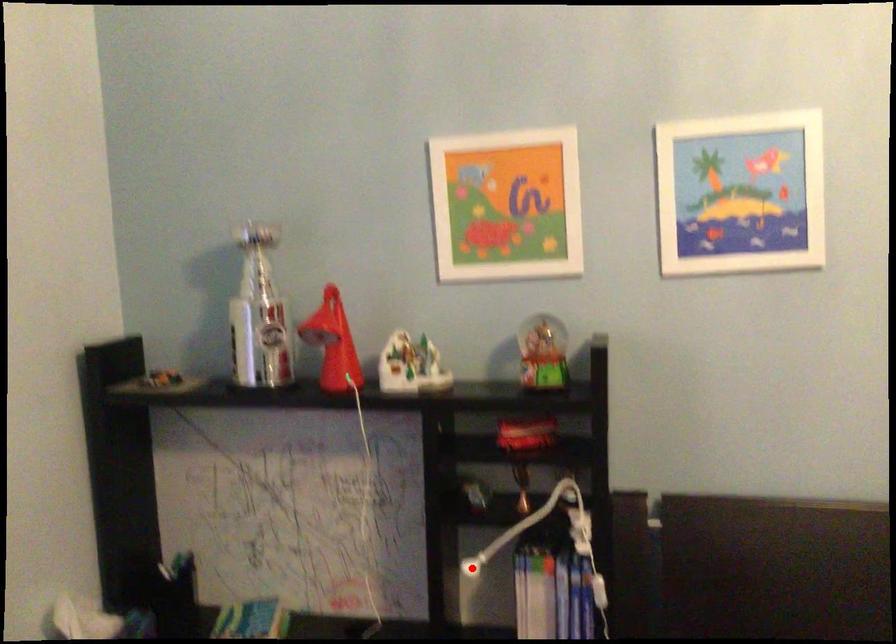
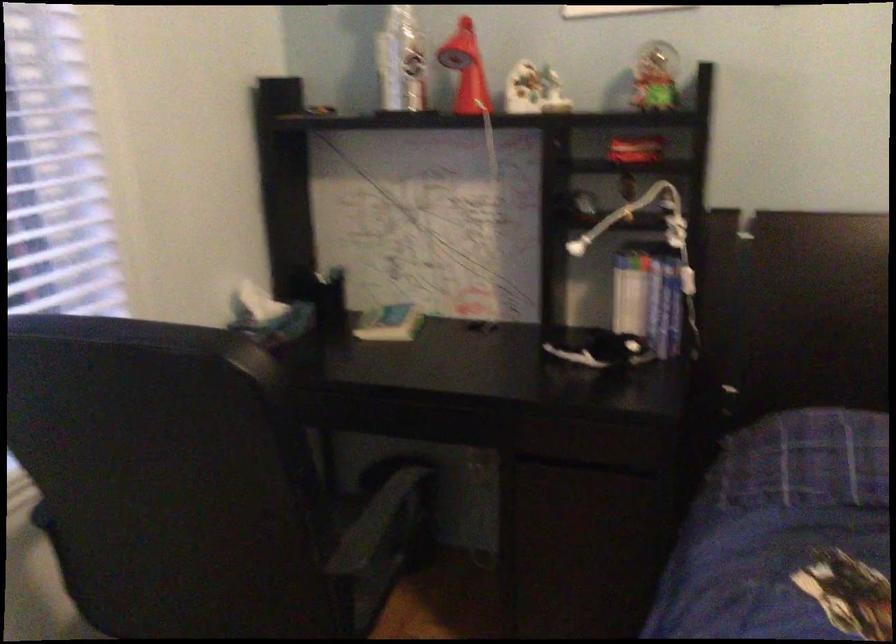
Locate, in the second image, the point that corresponds to the highlighted location in the first image.

(576, 247)